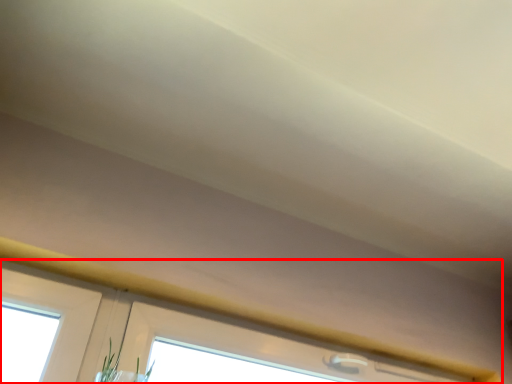
Question: From the image's perspective, considering the relative positions of window (annotated by the red box) and plant in the image provided, where is window (annotated by the red box) located with respect to the staircase?

Choices:
 (A) below
 (B) above

Answer: (B)